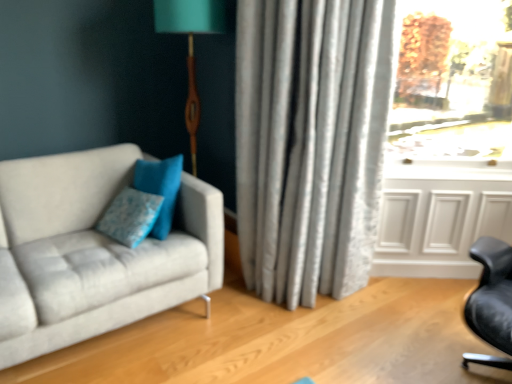
Question: From a real-world perspective, is white paneling at lower right on top of silky gray curtain at center?

Choices:
 (A) no
 (B) yes

Answer: (A)

Question: Does white paneling at lower right have a lesser width compared to silky gray curtain at center?

Choices:
 (A) yes
 (B) no

Answer: (A)

Question: Can you confirm if white paneling at lower right is positioned to the left of silky gray curtain at center?

Choices:
 (A) no
 (B) yes

Answer: (A)

Question: Considering the relative sizes of white paneling at lower right and silky gray curtain at center in the image provided, is white paneling at lower right taller than silky gray curtain at center?

Choices:
 (A) yes
 (B) no

Answer: (B)

Question: Considering the relative positions of white paneling at lower right and silky gray curtain at center in the image provided, is white paneling at lower right to the right of silky gray curtain at center from the viewer's perspective?

Choices:
 (A) yes
 (B) no

Answer: (A)

Question: Are white paneling at lower right and silky gray curtain at center far apart?

Choices:
 (A) no
 (B) yes

Answer: (A)

Question: From a real-world perspective, is blue fabric pillow at center positioned over suede gray couch at left based on gravity?

Choices:
 (A) no
 (B) yes

Answer: (B)

Question: Could you tell me if blue fabric pillow at center is turned towards suede gray couch at left?

Choices:
 (A) yes
 (B) no

Answer: (A)

Question: Is blue fabric pillow at center in front of suede gray couch at left?

Choices:
 (A) no
 (B) yes

Answer: (A)

Question: Is blue fabric pillow at center not close to suede gray couch at left?

Choices:
 (A) yes
 (B) no

Answer: (B)

Question: Is blue fabric pillow at center taller than suede gray couch at left?

Choices:
 (A) yes
 (B) no

Answer: (B)

Question: Can you confirm if blue fabric pillow at center is positioned to the right of suede gray couch at left?

Choices:
 (A) no
 (B) yes

Answer: (B)

Question: Considering the relative positions of transparent glass window at upper right and blue fabric pillow at center in the image provided, is transparent glass window at upper right behind blue fabric pillow at center?

Choices:
 (A) no
 (B) yes

Answer: (B)